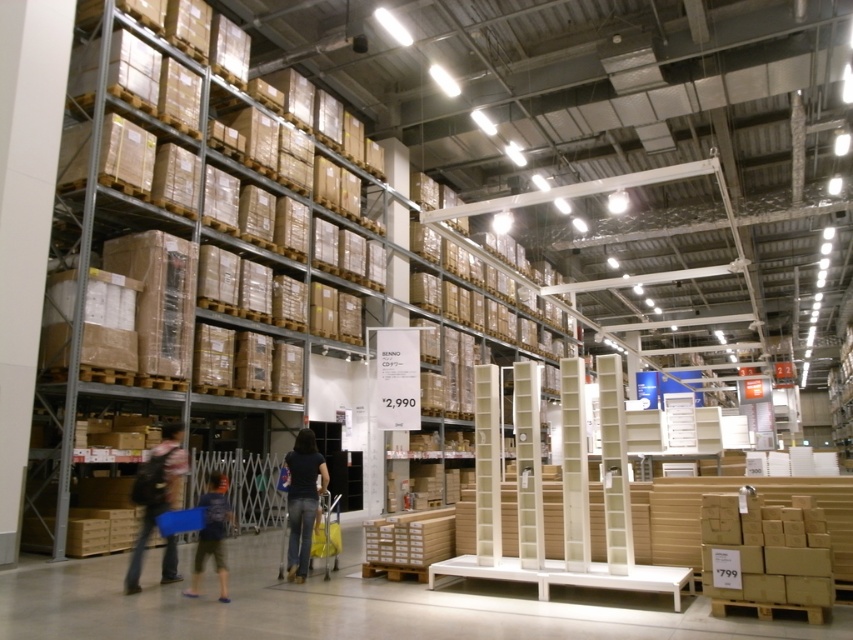
Which is below, dark blue shirt at center or dark blue jeans at lower left?

dark blue jeans at lower left is lower down.

The image size is (853, 640). I want to click on dark blue shirt at center, so click(x=302, y=500).

Locate an element on the screen. dark blue shirt at center is located at coordinates (302, 500).

Between denim jacket at lower left and dark blue jeans at lower left, which one has less height?

dark blue jeans at lower left

Which is below, denim jacket at lower left or dark blue jeans at lower left?

dark blue jeans at lower left is lower down.

What do you see at coordinates (155, 492) in the screenshot?
I see `denim jacket at lower left` at bounding box center [155, 492].

Locate an element on the screen. denim jacket at lower left is located at coordinates (155, 492).

Measure the distance from denim jacket at lower left to dark blue shirt at center.

denim jacket at lower left and dark blue shirt at center are 1.18 meters apart.

Who is lower down, denim jacket at lower left or dark blue shirt at center?

dark blue shirt at center is below.

Is point (158, 454) less distant than point (300, 442)?

Yes.

The height and width of the screenshot is (640, 853). I want to click on denim jacket at lower left, so click(x=155, y=492).